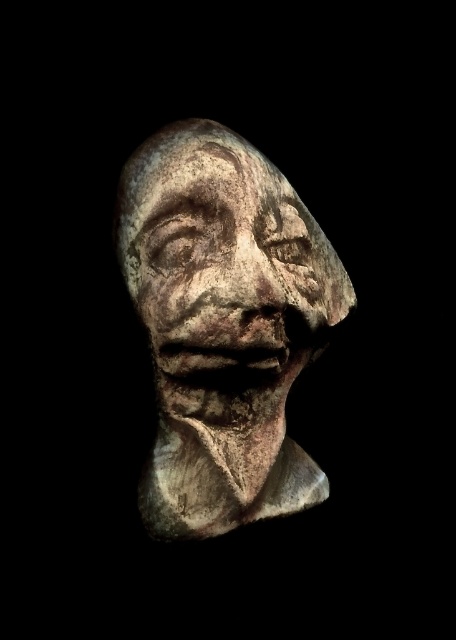
You are an archaeologist examining the stone sculpture. You notice two parts labeled as the rustic stone bust at center and the rusty stone face at center. Which part has a greater width?

The rustic stone bust at center might be wider than the rusty stone face at center according to the description.

You are standing in front of the rustic stone bust at center. If you take one step forward, will you be closer than 1 meter to it?

The rustic stone bust at center is currently 1.20 meters away from you. If you take one step forward, you would reduce the distance by approximately 0.3 to 0.5 meters, placing you between 0.70 to 0.90 meters away. This means you would be closer than 1 meter to the rustic stone bust at center.

You are an art conservator working on a restoration project. You have two stone pieces labeled as rustic stone bust at center and rusty stone face at center. Given the distance between them, can you determine if they are separate pieces or parts of the same sculpture?

The distance between rustic stone bust at center and rusty stone face at center is 0.56 inches, which suggests they are separate pieces since there is a measurable gap between them.